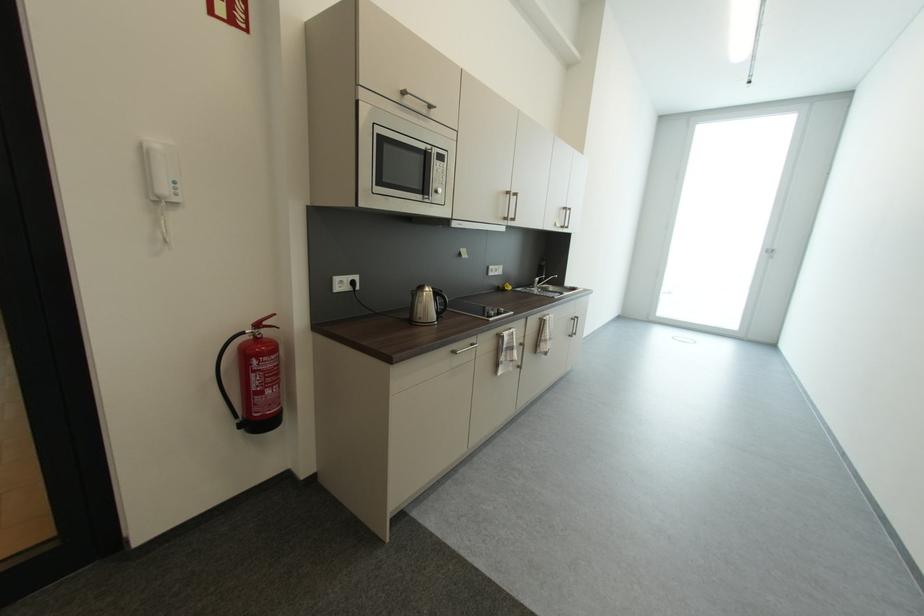
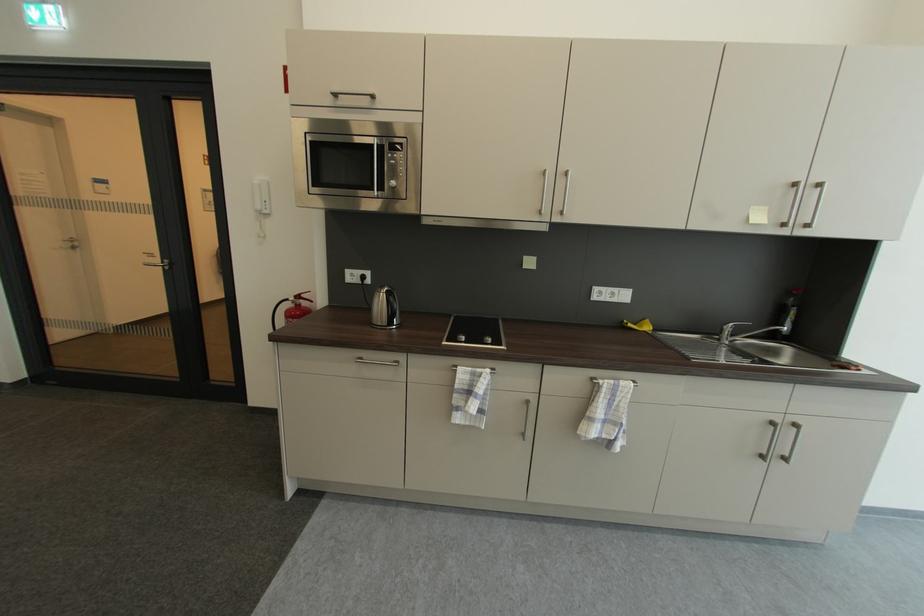
Find the pixel in the second image that matches [538,288] in the first image.

(723, 339)